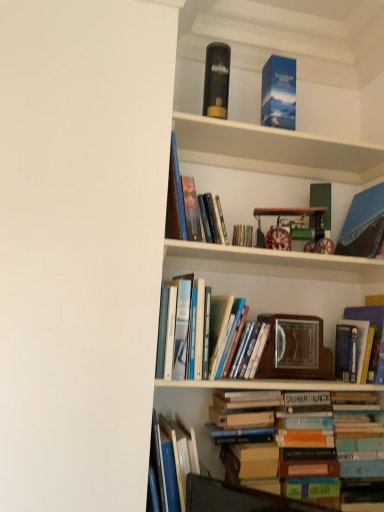
Question: Can you confirm if hardcover book at center, arranged as the 2th book when viewed from the top, is shorter than hardcover book at lower center, the first book positioned from the bottom?

Choices:
 (A) yes
 (B) no

Answer: (B)

Question: Can you confirm if hardcover book at center, positioned as the seventh book in bottom-to-top order, is wider than hardcover book at lower center, the first book positioned from the bottom?

Choices:
 (A) yes
 (B) no

Answer: (A)

Question: Considering the relative sizes of hardcover book at center, positioned as the seventh book in bottom-to-top order, and hardcover book at lower center, the first book positioned from the bottom, in the image provided, is hardcover book at center, positioned as the seventh book in bottom-to-top order, taller than hardcover book at lower center, the first book positioned from the bottom,?

Choices:
 (A) yes
 (B) no

Answer: (A)

Question: Is hardcover book at center, arranged as the 2th book when viewed from the top, oriented away from hardcover book at lower center, the first book positioned from the bottom?

Choices:
 (A) no
 (B) yes

Answer: (A)

Question: Is hardcover book at center, arranged as the 2th book when viewed from the top, beside hardcover book at lower center, the first book positioned from the bottom?

Choices:
 (A) no
 (B) yes

Answer: (A)

Question: From a real-world perspective, is blue cardboard box at upper center physically located above or below black matte book at upper center?

Choices:
 (A) above
 (B) below

Answer: (B)

Question: In terms of height, does blue cardboard box at upper center look taller or shorter compared to black matte book at upper center?

Choices:
 (A) short
 (B) tall

Answer: (A)

Question: Visually, is blue cardboard box at upper center positioned to the left or to the right of black matte book at upper center?

Choices:
 (A) right
 (B) left

Answer: (A)

Question: Looking at the image, does blue cardboard box at upper center seem bigger or smaller compared to black matte book at upper center?

Choices:
 (A) small
 (B) big

Answer: (B)

Question: Looking at the image, does hardcover books at center, which is counted as the 2th book, starting from the bottom, seem bigger or smaller compared to hardcover book at center, positioned as the sixth book in top-to-bottom order?

Choices:
 (A) big
 (B) small

Answer: (A)

Question: Is point (281, 477) positioned closer to the camera than point (374, 354)?

Choices:
 (A) closer
 (B) farther

Answer: (A)

Question: From a real-world perspective, is hardcover books at center, which is counted as the 2th book, starting from the bottom, physically located above or below hardcover book at center, which appears as the third book when ordered from the bottom?

Choices:
 (A) above
 (B) below

Answer: (B)

Question: In the image, is hardcover books at center, the 7th book from the top, positioned in front of or behind hardcover book at center, which appears as the third book when ordered from the bottom?

Choices:
 (A) behind
 (B) front

Answer: (B)

Question: From a real-world perspective, is hardcover book at center, which appears as the third book when ordered from the bottom, above or below hardcover book at center, arranged as the 2th book when viewed from the top?

Choices:
 (A) below
 (B) above

Answer: (A)

Question: Is hardcover book at center, which appears as the third book when ordered from the bottom, spatially inside hardcover book at center, arranged as the 2th book when viewed from the top, or outside of it?

Choices:
 (A) outside
 (B) inside

Answer: (A)